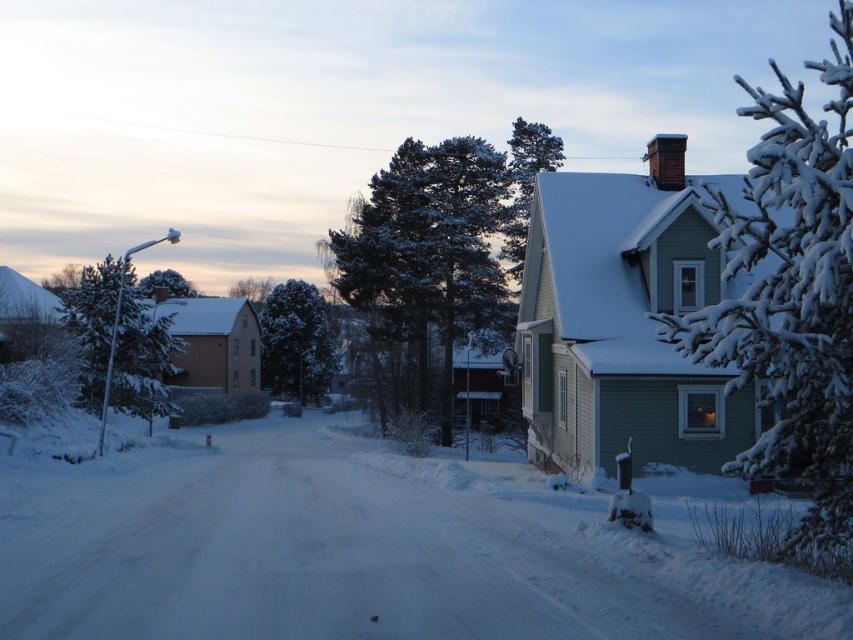
You are a delivery person trying to find the house on the right. You see the white fluffy snow at center and the green textured tree at center. Which object is closer to the house?

The green textured tree at center is closer to the house because the white fluffy snow at center is positioned on the right side of it, meaning the tree is between the snow and the house.